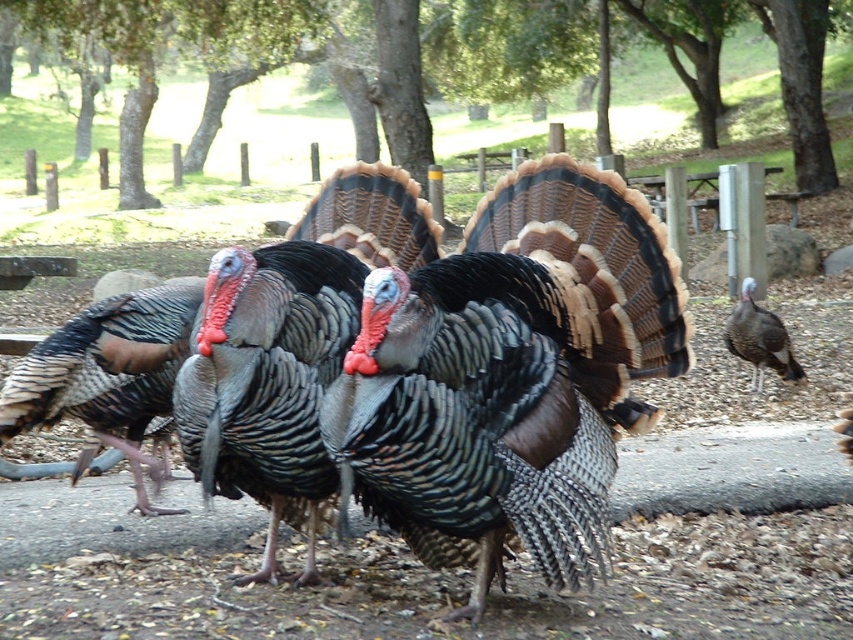
Can you confirm if shiny metallic turkey at center is thinner than gray feathered turkey at right?

No.

Is point (659, 248) positioned after point (757, 308)?

That is False.

Find the location of a particular element. shiny metallic turkey at center is located at coordinates (511, 376).